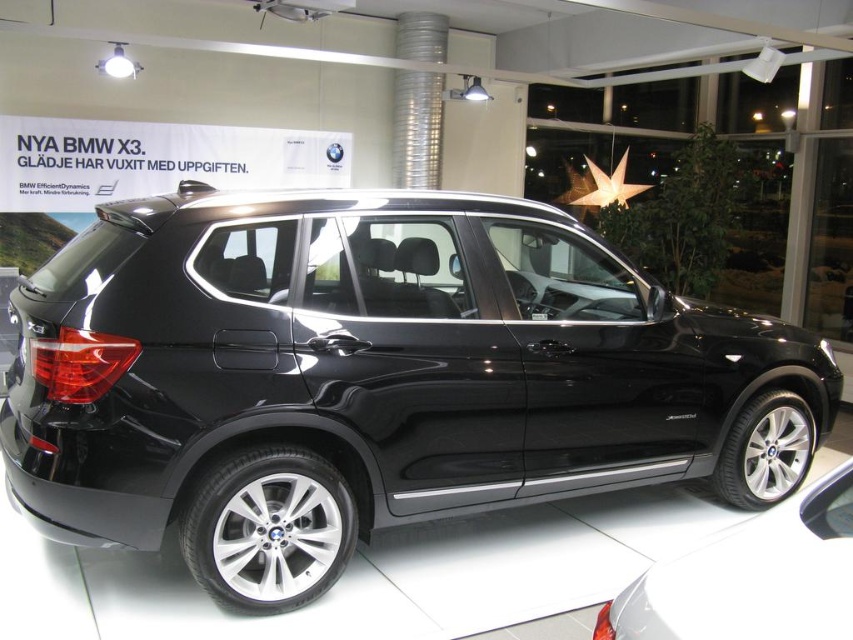
Question: Which point is farther to the camera?

Choices:
 (A) glossy black suv at center
 (B) black metallic car at lower right

Answer: (A)

Question: Can you confirm if glossy black suv at center is positioned to the left of black metallic car at lower right?

Choices:
 (A) yes
 (B) no

Answer: (A)

Question: Can you confirm if glossy black suv at center is bigger than black metallic car at lower right?

Choices:
 (A) no
 (B) yes

Answer: (B)

Question: Which point is farther to the camera?

Choices:
 (A) (358, 216)
 (B) (753, 518)

Answer: (A)

Question: Is glossy black suv at center to the right of black metallic car at lower right from the viewer's perspective?

Choices:
 (A) no
 (B) yes

Answer: (A)